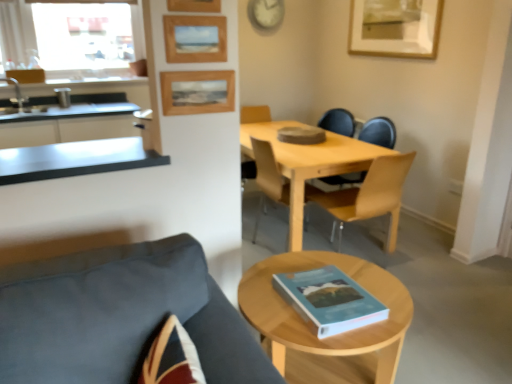
Identify the location of vacant point to the left of blue matte book at lower center. (264, 307).